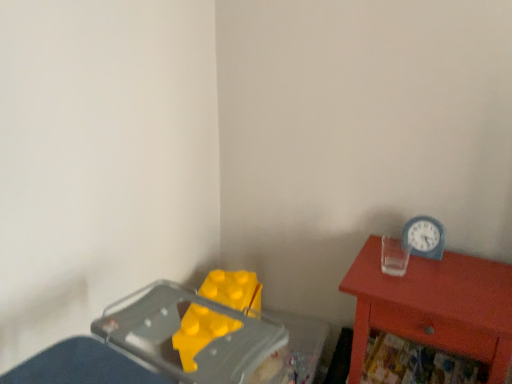
Find the location of a particular element. free space above matte red nightstand at right (from a real-world perspective) is located at coordinates (424, 273).